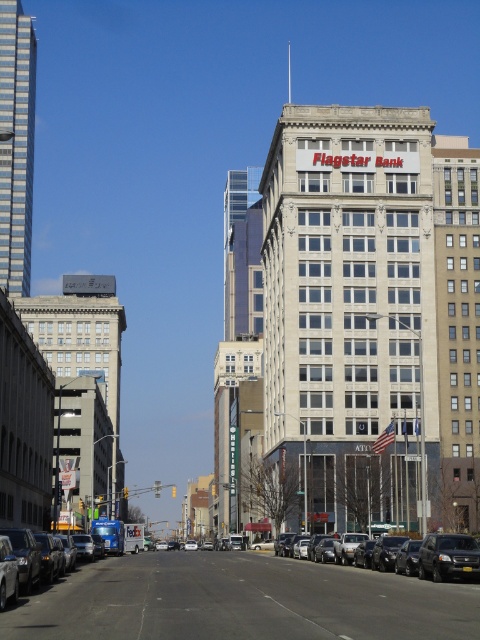
Image resolution: width=480 pixels, height=640 pixels. What do you see at coordinates (429, 556) in the screenshot?
I see `black glossy sedan at center` at bounding box center [429, 556].

Image resolution: width=480 pixels, height=640 pixels. Describe the element at coordinates (429, 556) in the screenshot. I see `black glossy sedan at center` at that location.

At what (x,y) coordinates should I click in order to perform the action: click on black glossy sedan at center. Please return your answer as a coordinate pair (x, y). Looking at the image, I should click on (429, 556).